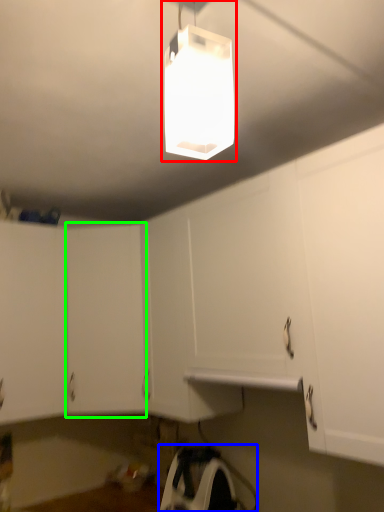
Question: Based on their relative distances, which object is nearer to lamp (highlighted by a red box)? Choose from appliance (highlighted by a blue box) and cabinetry (highlighted by a green box).

Choices:
 (A) appliance
 (B) cabinetry

Answer: (B)